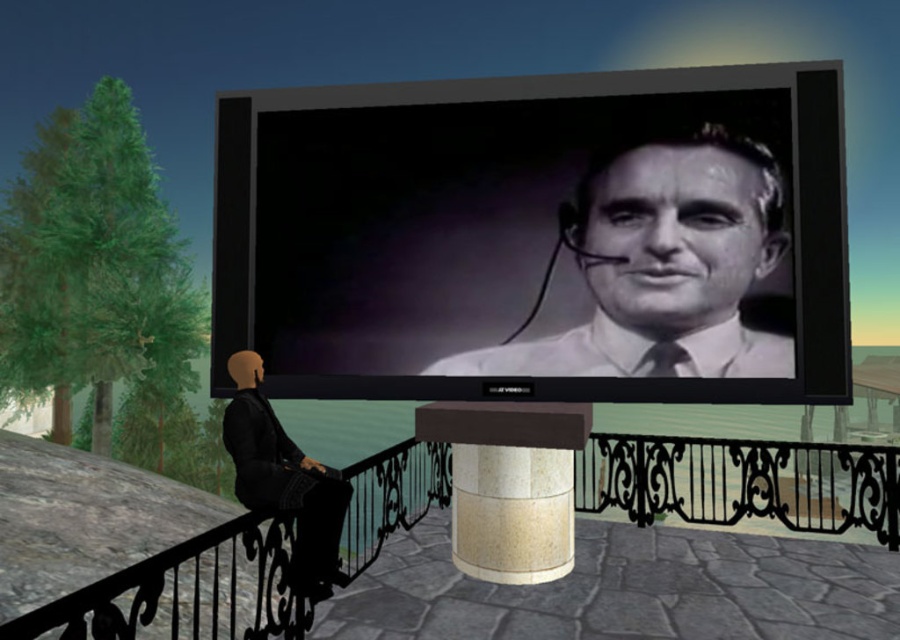
Between black glossy screen at center and black matte/texture man at upper center, which one appears on the right side from the viewer's perspective?

Positioned to the right is black matte/texture man at upper center.

Between black glossy screen at center and black matte/texture man at upper center, which one has less height?

Standing shorter between the two is black matte/texture man at upper center.

Find the location of a particular element. This screenshot has width=900, height=640. black glossy screen at center is located at coordinates (538, 237).

Is black wrought iron balustrade at lower center closer to camera compared to beige marble pillar at center?

Yes, it is.

Between point (371, 554) and point (473, 540), which one is positioned in front?

Point (473, 540) is in front.

Where is `black wrought iron balustrade at lower center`? black wrought iron balustrade at lower center is located at coordinates (741, 481).

Does beige marble pillar at center lie in front of black fabric jacket at lower left?

That is False.

Which is above, beige marble pillar at center or black fabric jacket at lower left?

black fabric jacket at lower left is higher up.

Is point (524, 579) farther from viewer compared to point (239, 385)?

Yes, point (524, 579) is farther from viewer.

Find the location of `beige marble pillar at center`. beige marble pillar at center is located at coordinates (509, 484).